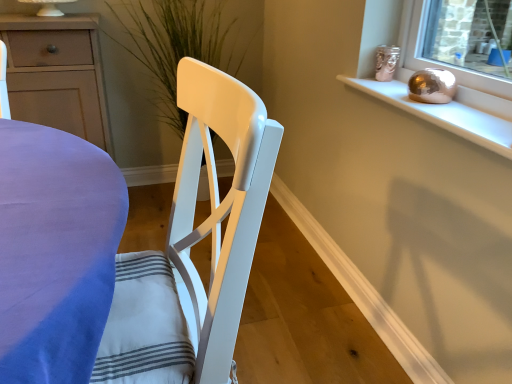
Question: From their relative heights in the image, would you say green matte plant at center is taller or shorter than matte white cabinet at left?

Choices:
 (A) tall
 (B) short

Answer: (A)

Question: Considering the relative positions of green matte plant at center and matte white cabinet at left in the image provided, is green matte plant at center to the left or to the right of matte white cabinet at left?

Choices:
 (A) right
 (B) left

Answer: (A)

Question: Which is nearer to the metallic gold sphere at upper right?

Choices:
 (A) matte white cabinet at left
 (B) white glossy chair at center
 (C) green matte plant at center

Answer: (B)

Question: Based on their relative distances, which object is nearer to the white glossy chair at center?

Choices:
 (A) metallic gold sphere at upper right
 (B) matte white cabinet at left
 (C) green matte plant at center

Answer: (A)